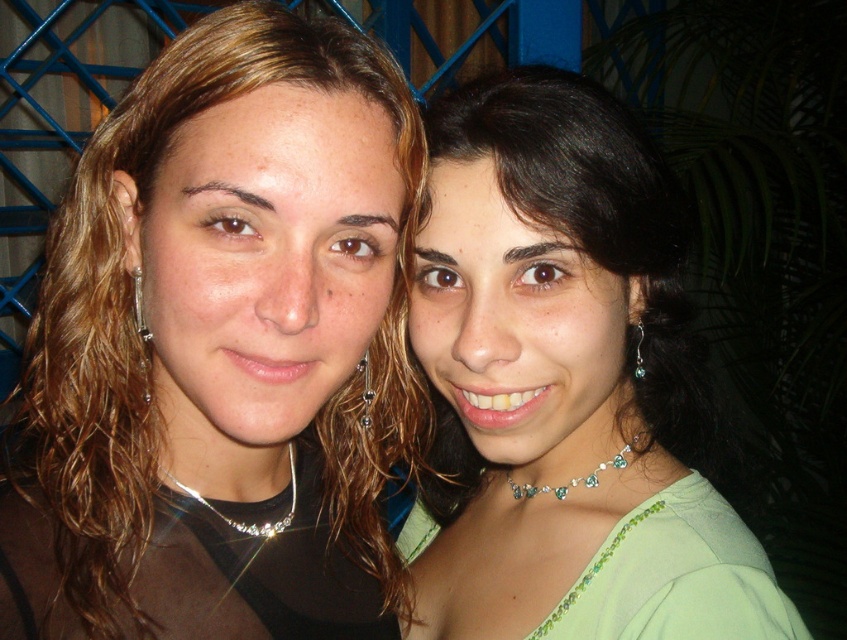
You are taking a photo of two people standing in front of a blue lattice fence. You notice two points marked in the image at coordinates point (285, 515) and point (587, 483). Which point is closer to the camera?

Point (285, 515) is closer to the camera than point (587, 483).

You are taking a photo of two people standing in front of a blue lattice fence. You notice two points marked on the image at coordinates point (400,280) and point (248,529). Which point is closer to the camera?

Point (248,529) is closer to the camera because point (400,280) is behind it.